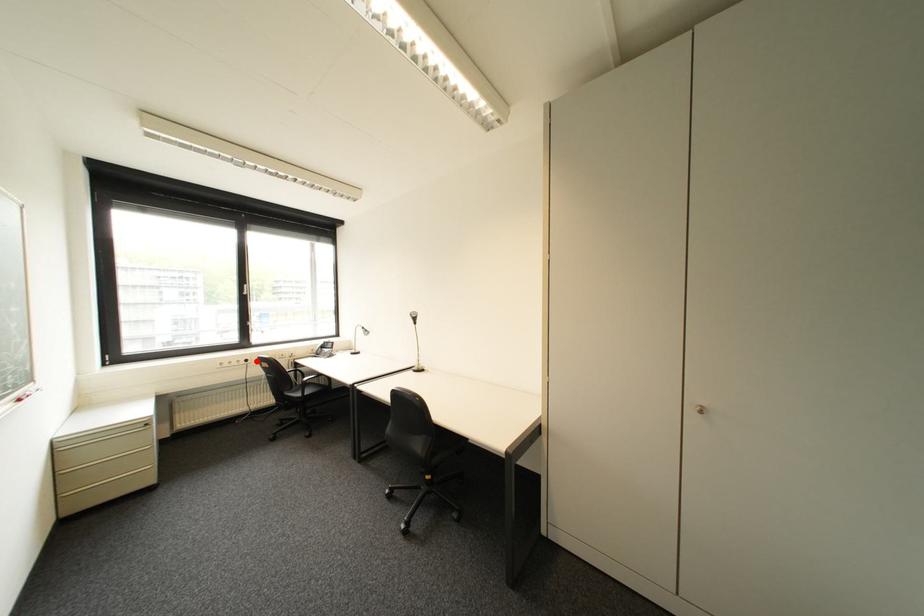
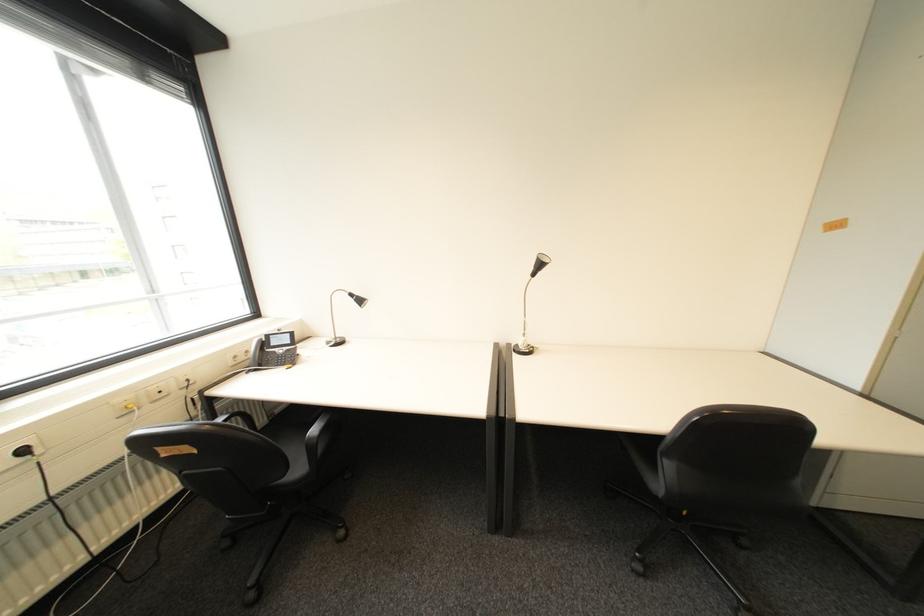
Where in the second image is the point corresponding to the highlighted location from the first image?

(34, 452)